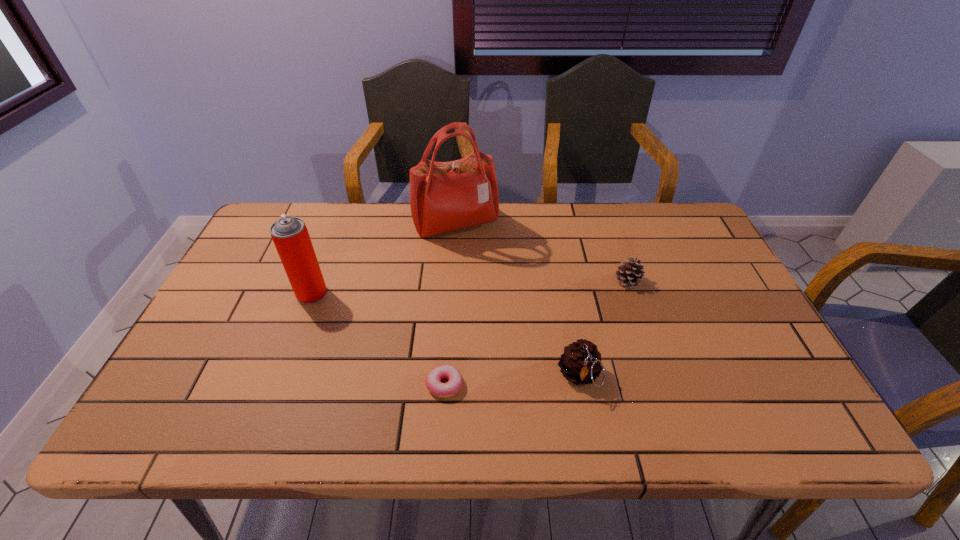
Where is `free space at the far right corner`? free space at the far right corner is located at coordinates (700, 226).

Where is `vacant space at the near right corner`? The height and width of the screenshot is (540, 960). vacant space at the near right corner is located at coordinates (747, 401).

Where is `vacant space that is in between the farthest object and the doughnut`? vacant space that is in between the farthest object and the doughnut is located at coordinates (450, 305).

Find the location of `free space between the rightmost object and the shortest object`. free space between the rightmost object and the shortest object is located at coordinates (536, 333).

This screenshot has width=960, height=540. Find the location of `free space between the leftmost object and the left pinecone`. free space between the leftmost object and the left pinecone is located at coordinates (445, 335).

Find the location of a particular element. This screenshot has width=960, height=540. free space that is in between the second object from right to left and the doughnut is located at coordinates (512, 380).

Find the location of a particular element. unoccupied area between the rightmost object and the taller pinecone is located at coordinates (603, 329).

Locate an element on the screen. vacant space in between the shorter pinecone and the second object from right to left is located at coordinates (603, 329).

Where is `vacant space in between the handbag and the farther pinecone`? The width and height of the screenshot is (960, 540). vacant space in between the handbag and the farther pinecone is located at coordinates (541, 253).

Locate an element on the screen. Image resolution: width=960 pixels, height=540 pixels. free area in between the taller pinecone and the leftmost object is located at coordinates click(445, 335).